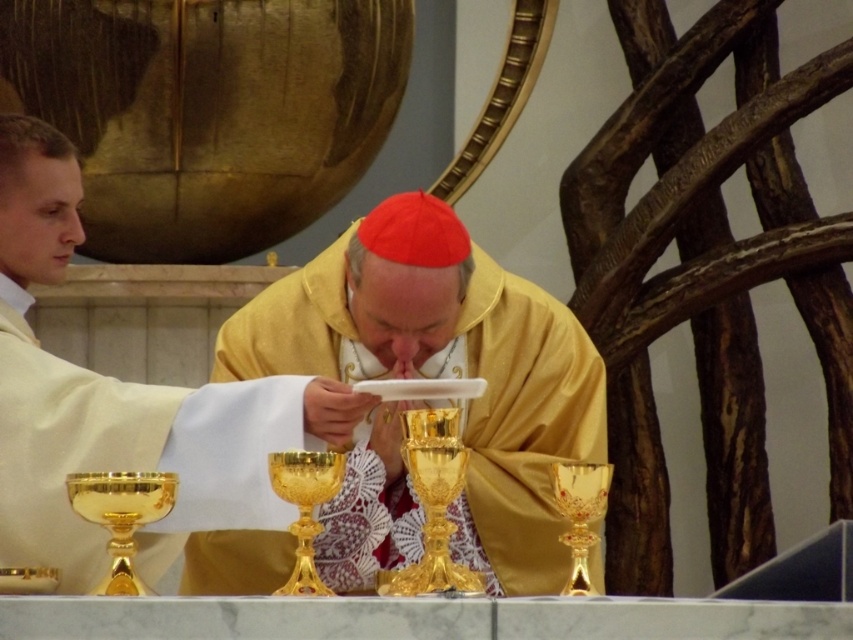
Measure the distance between point (212,490) and camera.

Point (212,490) and camera are 154.53 feet apart.

Is point (1, 545) farther from camera compared to point (328, 248)?

No, (1, 545) is in front of (328, 248).

This screenshot has height=640, width=853. Find the location of `white matte robe at left`. white matte robe at left is located at coordinates (120, 401).